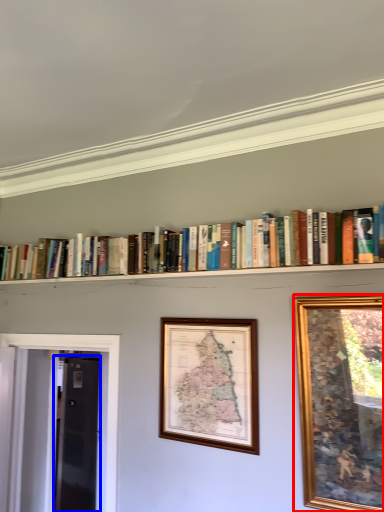
Question: Among these objects, which one is nearest to the camera, picture frame (highlighted by a red box) or glass door (highlighted by a blue box)?

Choices:
 (A) picture frame
 (B) glass door

Answer: (A)